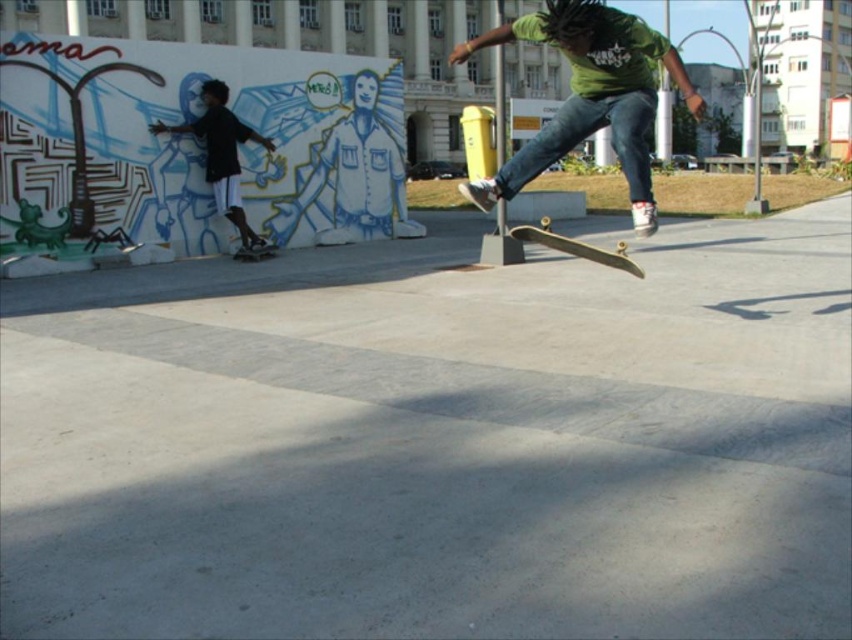
You are a photographer positioned at the origin point of the coordinate system. You want to capture a photo of the green matte skateboard at center. What are the coordinates where you should aim your camera?

The green matte skateboard at center is located at point (589,97), so you should aim your camera at those coordinates to capture it.

You are a photographer trying to capture the skateboarder midair. You notice a point at coordinates (x=574, y=246). Where is this point located relative to the wooden skateboard at center?

The point at coordinates (x=574, y=246) is located on the wooden skateboard at center.

Consider the image. You are standing at the point marked with coordinates point (563, 244) and want to throw a frisbee to your friend who is at the other end. The maximum distance you can throw is 7 meters. Will you be able to reach them?

The distance between you and your friend is 7.12 meters, which is slightly beyond your throwing range of 7 meters. You won not be able to reach them in one throw.